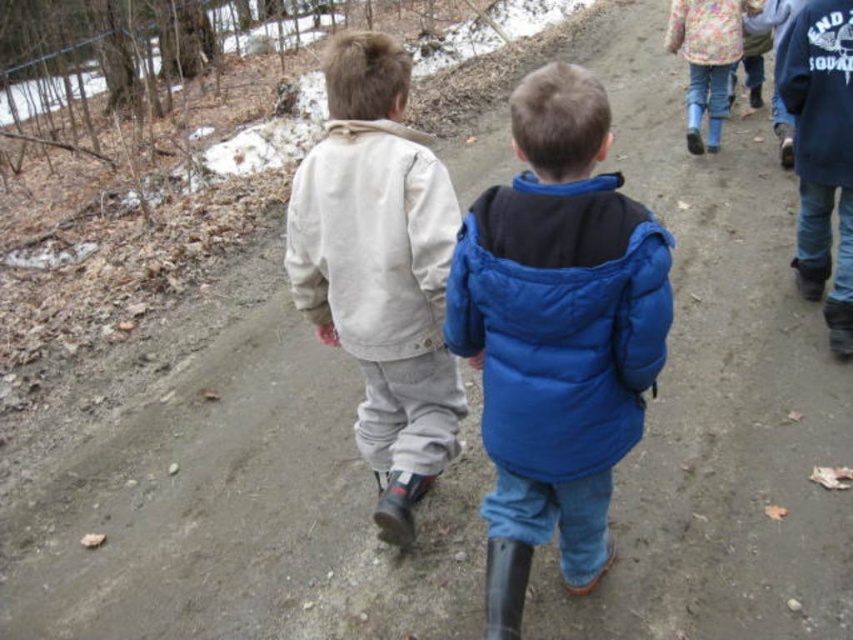
You are a photographer trying to capture both children in a single frame. Given that the light beige fleece jacket at center is wider than the blue puffy jacket at center, which child should you focus on to ensure both fit in the frame?

Since the light beige fleece jacket at center is wider than the blue puffy jacket at center, you should focus on the child wearing the light beige fleece jacket at center to ensure both children fit within the frame.